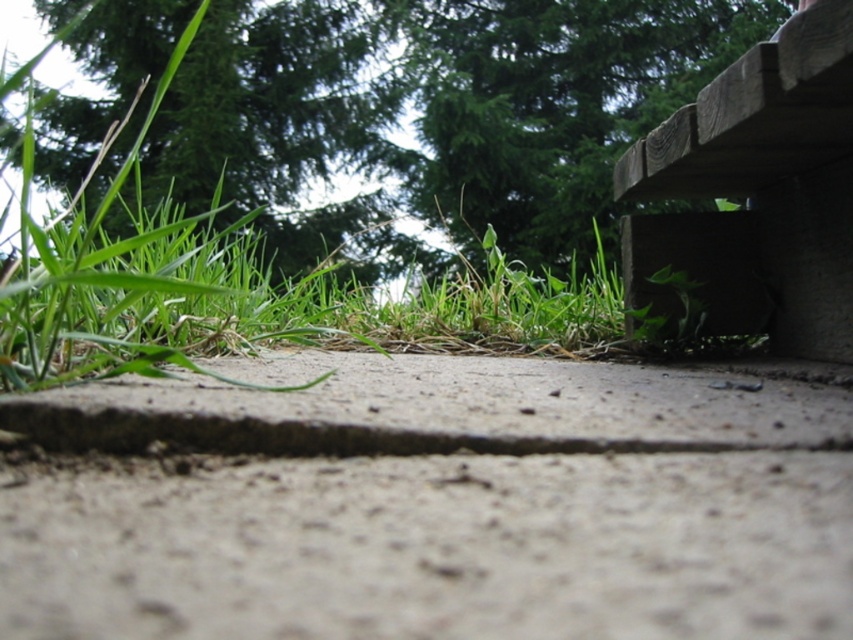
Between gray concrete at center and green leafy tree at upper center, which one is positioned lower?

gray concrete at center is lower down.

Is gray concrete at center above green leafy tree at upper center?

Incorrect, gray concrete at center is not positioned above green leafy tree at upper center.

This screenshot has height=640, width=853. I want to click on gray concrete at center, so click(x=432, y=502).

Who is positioned more to the right, green leafy tree at upper center or wooden bench at upper right?

From the viewer's perspective, wooden bench at upper right appears more on the right side.

Between point (305, 147) and point (646, 268), which one is positioned behind?

Positioned behind is point (305, 147).

The width and height of the screenshot is (853, 640). Find the location of `green leafy tree at upper center`. green leafy tree at upper center is located at coordinates (444, 104).

Who is more forward, (631, 532) or (798, 280)?

Point (631, 532) is in front.

The width and height of the screenshot is (853, 640). Describe the element at coordinates (432, 502) in the screenshot. I see `gray concrete at center` at that location.

Measure the distance between point (155, 424) and camera.

They are 25.37 inches apart.

At what (x,y) coordinates should I click in order to perform the action: click on gray concrete at center. Please return your answer as a coordinate pair (x, y). Looking at the image, I should click on (432, 502).